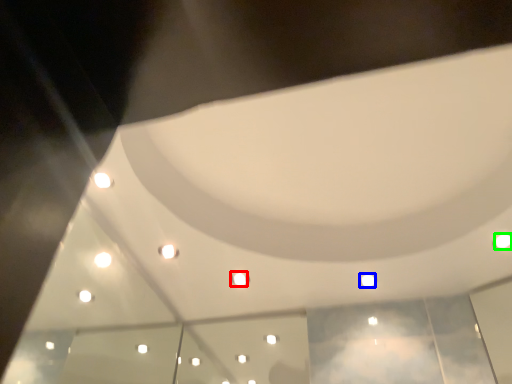
Question: Which is farther away from light (highlighted by a red box)? light (highlighted by a blue box) or light (highlighted by a green box)?

Choices:
 (A) light
 (B) light

Answer: (B)